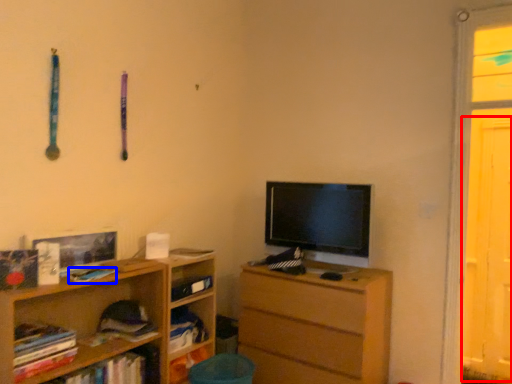
Question: Which of the following is the closest to the observer, screen door (highlighted by a red box) or book (highlighted by a blue box)?

Choices:
 (A) screen door
 (B) book

Answer: (B)